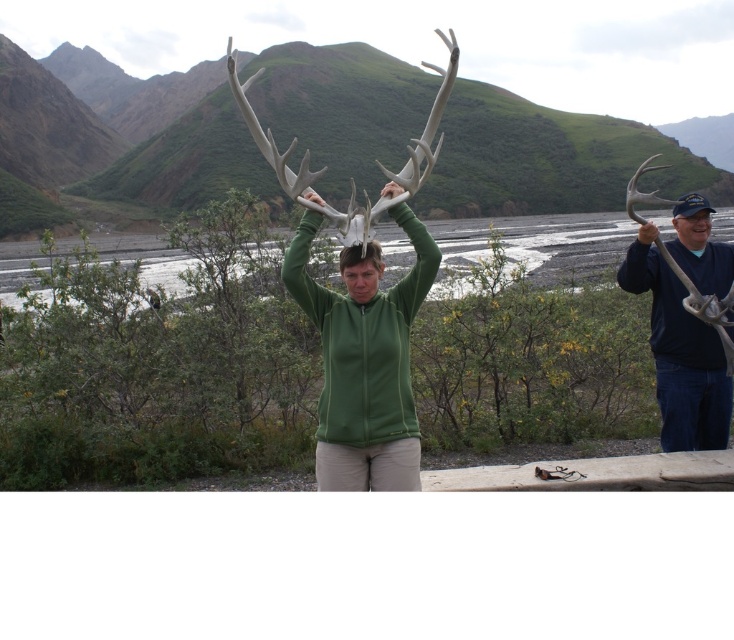
Question: Is dark blue fabric antlers at right to the right of white matte antlers at center from the viewer's perspective?

Choices:
 (A) yes
 (B) no

Answer: (A)

Question: Which of these objects is positioned closest to the dark blue fabric antlers at right?

Choices:
 (A) green matte deer antlers at center
 (B) matte black antlers at right
 (C) white matte antlers at center

Answer: (B)

Question: Which object appears farthest from the camera in this image?

Choices:
 (A) green matte deer antlers at center
 (B) dark blue fabric antlers at right
 (C) matte black antlers at right
 (D) white matte antlers at center

Answer: (C)

Question: Does white matte antlers at center have a smaller size compared to green matte jacket at center?

Choices:
 (A) no
 (B) yes

Answer: (A)

Question: Based on their relative distances, which object is farther from the matte black antlers at right?

Choices:
 (A) white matte antlers at center
 (B) green matte jacket at center
 (C) green matte deer antlers at center
 (D) dark blue fabric antlers at right

Answer: (A)

Question: Is dark blue fabric antlers at right smaller than green matte jacket at center?

Choices:
 (A) yes
 (B) no

Answer: (B)